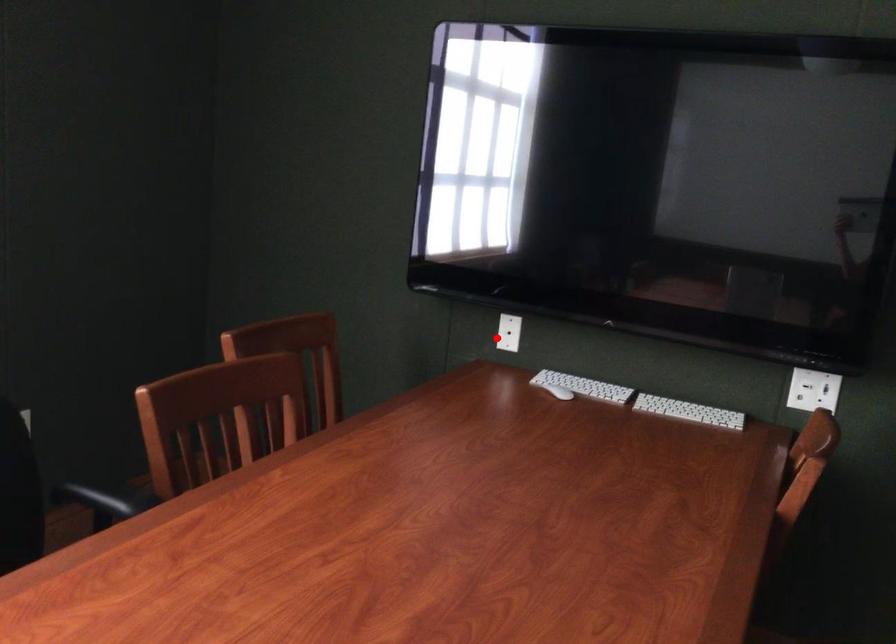
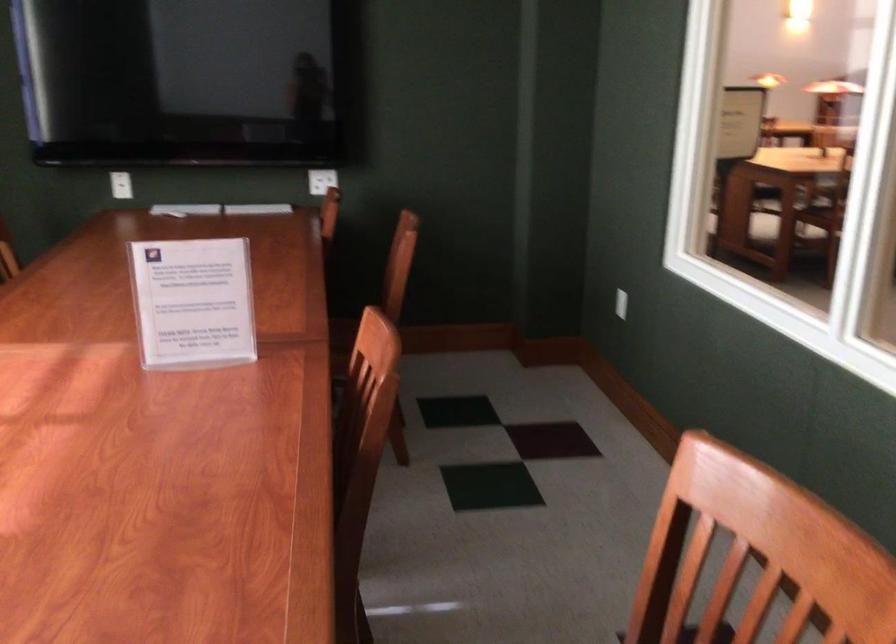
Where in the second image is the point corresponding to the highlighted location from the first image?

(121, 185)